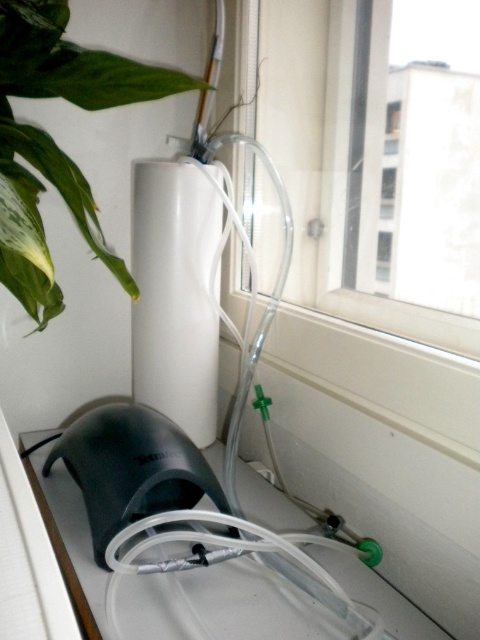
Who is more distant from viewer, (x=308, y=266) or (x=62, y=16)?

Positioned behind is point (x=308, y=266).

Is point (300, 180) positioned in front of point (200, 90)?

That is False.

Locate an element on the screen. The image size is (480, 640). transparent glass window at upper right is located at coordinates [373, 173].

Based on the photo, does transparent glass window at upper right appear under black matte mouse at lower left?

Incorrect, transparent glass window at upper right is not positioned below black matte mouse at lower left.

Can you confirm if transparent glass window at upper right is bigger than black matte mouse at lower left?

Correct, transparent glass window at upper right is larger in size than black matte mouse at lower left.

At what (x,y) coordinates should I click in order to perform the action: click on transparent glass window at upper right. Please return your answer as a coordinate pair (x, y). This screenshot has width=480, height=640. Looking at the image, I should click on (373, 173).

Identify the location of transparent glass window at upper right. (373, 173).

Between green leafy plant at upper left and black matte mouse at lower left, which one is positioned higher?

green leafy plant at upper left is higher up.

How distant is green leafy plant at upper left from black matte mouse at lower left?

11.14 inches

Image resolution: width=480 pixels, height=640 pixels. In order to click on green leafy plant at upper left in this screenshot , I will do `click(56, 144)`.